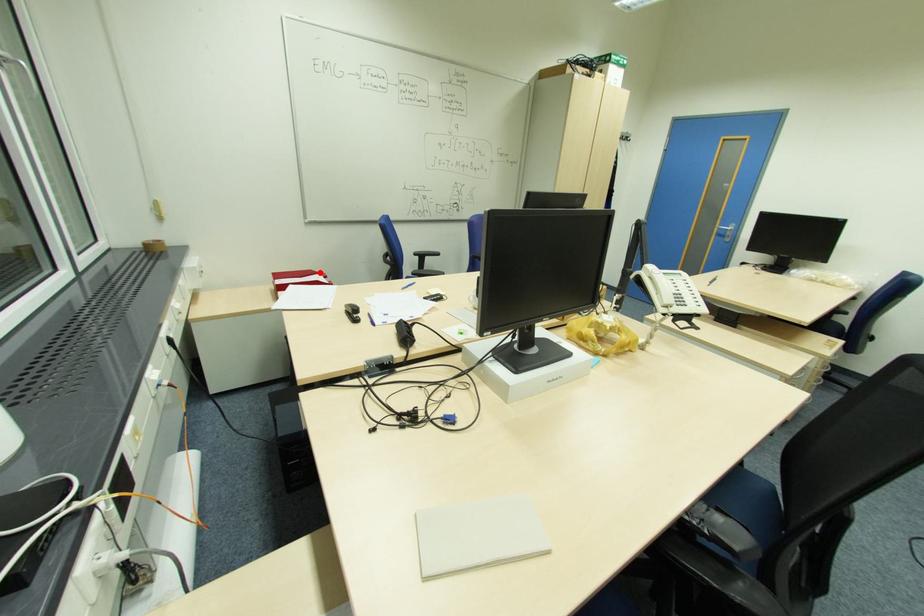
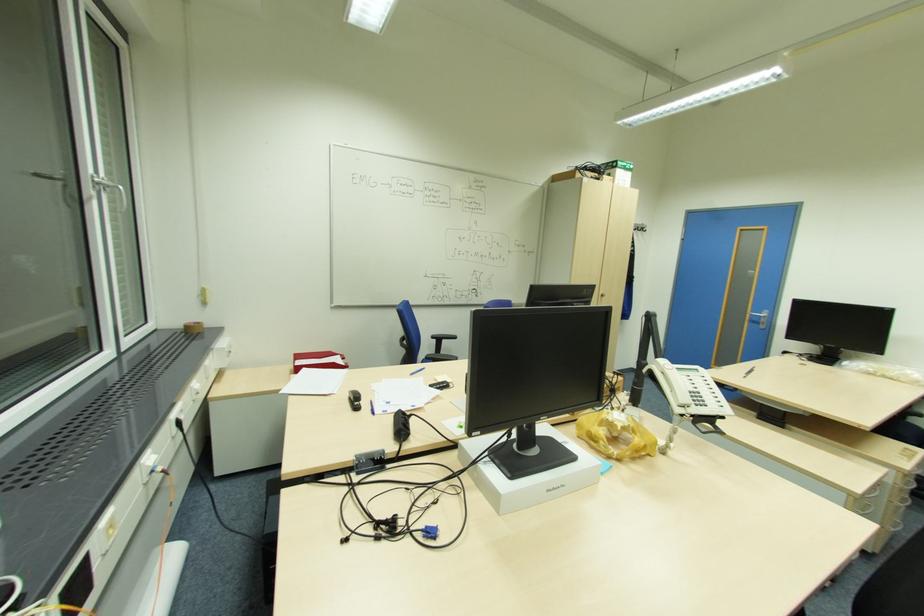
Question: A red point is marked in image1. In image2, is the corresponding 3D point closer to the camera or farther? Reply with the corresponding letter.

Choices:
 (A) The corresponding 3D point is closer.
 (B) The corresponding 3D point is farther.

Answer: (A)